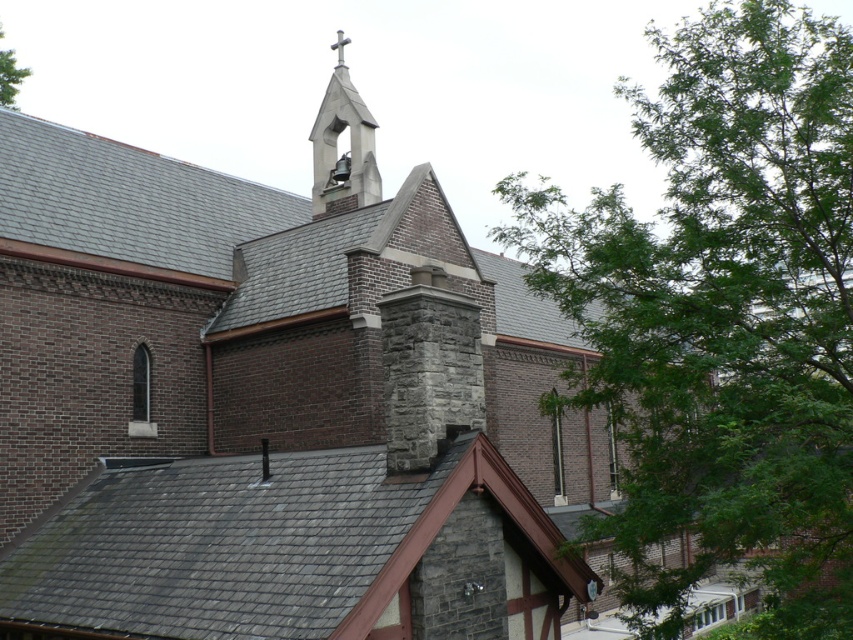
Question: Is white stone bell tower at upper center to the left of green leafy tree at upper left from the viewer's perspective?

Choices:
 (A) no
 (B) yes

Answer: (A)

Question: Which object is positioned farthest from the white stone bell tower at upper center?

Choices:
 (A) green leafy tree at upper right
 (B) green leafy tree at upper left

Answer: (B)

Question: Which point is closer to the camera taking this photo?

Choices:
 (A) (677, 348)
 (B) (28, 72)
 (C) (323, 200)

Answer: (A)

Question: Can you confirm if green leafy tree at upper right is thinner than green leafy tree at upper left?

Choices:
 (A) no
 (B) yes

Answer: (A)

Question: Which object is the farthest from the green leafy tree at upper right?

Choices:
 (A) green leafy tree at upper left
 (B) white stone bell tower at upper center

Answer: (A)

Question: Does green leafy tree at upper right lie in front of white stone bell tower at upper center?

Choices:
 (A) no
 (B) yes

Answer: (B)